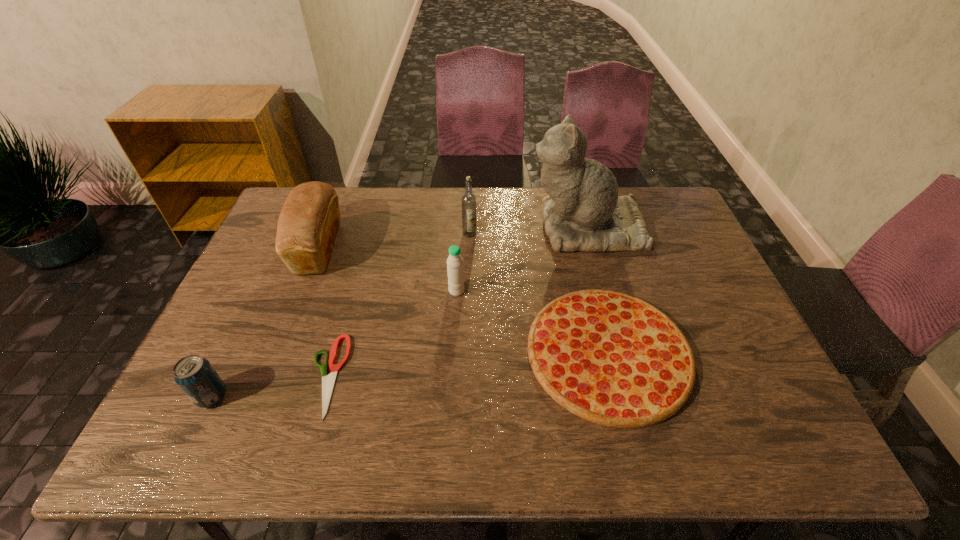
Find the location of a particular element. The image size is (960, 540). cat is located at coordinates (583, 212).

Where is `the second tallest object`? This screenshot has height=540, width=960. the second tallest object is located at coordinates (468, 201).

Find the location of a particular element. Image resolution: width=960 pixels, height=540 pixels. the sixth object from right to left is located at coordinates (309, 220).

You are a GUI agent. You are given a task and a screenshot of the screen. Output one action in this format:
    pyautogui.click(x=<x>, y=<y>)
    Task: Click on the water bottle
    The width and height of the screenshot is (960, 540).
    Given the screenshot: What is the action you would take?
    pyautogui.click(x=455, y=269)

Where is `pop soda`? pop soda is located at coordinates (196, 377).

Locate an element on the screen. The height and width of the screenshot is (540, 960). the leftmost object is located at coordinates (196, 377).

Locate an element on the screen. This screenshot has height=540, width=960. pizza is located at coordinates (610, 358).

I want to click on scissors, so click(x=328, y=381).

Where is `the shortest object`? The width and height of the screenshot is (960, 540). the shortest object is located at coordinates (328, 381).

Locate an element on the screen. free space located 0.350m on the front-facing side of the cat is located at coordinates pos(423,227).